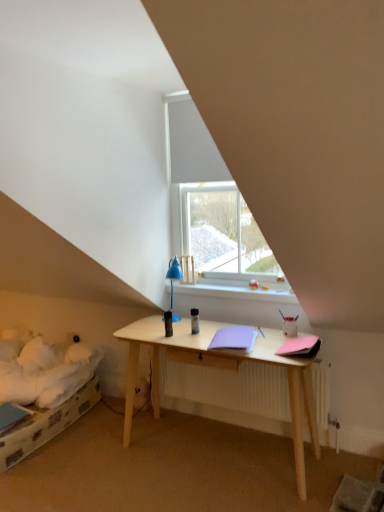
What is the approximate height of transparent glass window at center?

4.38 feet.

I want to click on transparent glass window at center, so click(211, 205).

Where is `white plastic window sill at center`? The height and width of the screenshot is (512, 384). white plastic window sill at center is located at coordinates (237, 291).

Locate an element on the screen. The width and height of the screenshot is (384, 512). transparent glass window at center is located at coordinates (211, 205).

Is point (227, 342) positioned in front of point (292, 301)?

Yes.

Considering the relative sizes of lavender matte notebook at center, positioned as the first notebook in left-to-right order, and white plastic window sill at center in the image provided, is lavender matte notebook at center, positioned as the first notebook in left-to-right order, bigger than white plastic window sill at center?

No, lavender matte notebook at center, positioned as the first notebook in left-to-right order, is not bigger than white plastic window sill at center.

From the picture: Is lavender matte notebook at center, positioned as the first notebook in left-to-right order, looking in the opposite direction of white plastic window sill at center?

No, lavender matte notebook at center, positioned as the first notebook in left-to-right order,'s orientation is not away from white plastic window sill at center.

Is lavender matte notebook at center, positioned as the first notebook in left-to-right order, at the right side of white plastic window sill at center?

Incorrect, lavender matte notebook at center, positioned as the first notebook in left-to-right order, is not on the right side of white plastic window sill at center.

You are a GUI agent. You are given a task and a screenshot of the screen. Output one action in this format:
    pyautogui.click(x=<x>, y=<y>)
    Task: Click on the 1st notebook below when counting from the white plastic window sill at center (from the image's perspective)
    This screenshot has width=384, height=512.
    Given the screenshot: What is the action you would take?
    pyautogui.click(x=234, y=338)

Between white plastic window sill at center and lavender matte notebook at center, positioned as the 2th notebook in right-to-left order, which one has more height?

With more height is white plastic window sill at center.

Choose the correct answer: Is white plastic window sill at center inside lavender matte notebook at center, positioned as the first notebook in left-to-right order, or outside it?

white plastic window sill at center is outside lavender matte notebook at center, positioned as the first notebook in left-to-right order.

From the image's perspective, which is below, white plastic window sill at center or lavender matte notebook at center, positioned as the 2th notebook in right-to-left order?

lavender matte notebook at center, positioned as the 2th notebook in right-to-left order, from the image's perspective.

How different are the orientations of transparent glass window at center and lavender matte notebook at center, positioned as the 2th notebook in right-to-left order, in degrees?

They differ by 12.9 degrees in their facing directions.

Where is `window above the lavender matte notebook at center, positioned as the first notebook in left-to-right order (from the image's perspective)`? window above the lavender matte notebook at center, positioned as the first notebook in left-to-right order (from the image's perspective) is located at coordinates (211, 205).

Considering the positions of objects transparent glass window at center and lavender matte notebook at center, positioned as the 2th notebook in right-to-left order, in the image provided, who is more to the left, transparent glass window at center or lavender matte notebook at center, positioned as the 2th notebook in right-to-left order,?

From the viewer's perspective, transparent glass window at center appears more on the left side.

Is white plastic window sill at center thinner than transparent glass window at center?

Incorrect, the width of white plastic window sill at center is not less than that of transparent glass window at center.

From the image's perspective, would you say white plastic window sill at center is positioned over transparent glass window at center?

No, from the image's perspective, white plastic window sill at center is not on top of transparent glass window at center.

Does white plastic window sill at center turn towards transparent glass window at center?

No, white plastic window sill at center is not aimed at transparent glass window at center.

This screenshot has width=384, height=512. Find the location of `window located in front of the white plastic window sill at center`. window located in front of the white plastic window sill at center is located at coordinates click(x=211, y=205).

Between pink matte notebook at right, positioned as the first notebook in right-to-left order, and white plastic window sill at center, which one has less height?

pink matte notebook at right, positioned as the first notebook in right-to-left order.

Which point is more forward, (313, 353) or (193, 294)?

Point (313, 353)

Does pink matte notebook at right, which ranks as the second notebook in left-to-right order, have a larger size compared to white plastic window sill at center?

No.

Is pink matte notebook at right, which ranks as the second notebook in left-to-right order, at the right side of white plastic window sill at center?

Indeed, pink matte notebook at right, which ranks as the second notebook in left-to-right order, is positioned on the right side of white plastic window sill at center.

Consider the image. Between lavender matte notebook at center, positioned as the first notebook in left-to-right order, and transparent glass window at center, which one has smaller size?

With smaller size is lavender matte notebook at center, positioned as the first notebook in left-to-right order.

From a real-world perspective, is lavender matte notebook at center, positioned as the 2th notebook in right-to-left order, physically located above or below transparent glass window at center?

From a real-world perspective, lavender matte notebook at center, positioned as the 2th notebook in right-to-left order, is physically below transparent glass window at center.

Could you measure the distance between lavender matte notebook at center, positioned as the 2th notebook in right-to-left order, and transparent glass window at center?

A distance of 39.02 inches exists between lavender matte notebook at center, positioned as the 2th notebook in right-to-left order, and transparent glass window at center.

Considering the positions of objects lavender matte notebook at center, positioned as the first notebook in left-to-right order, and transparent glass window at center in the image provided, who is in front, lavender matte notebook at center, positioned as the first notebook in left-to-right order, or transparent glass window at center?

lavender matte notebook at center, positioned as the first notebook in left-to-right order, is more forward.

From the image's perspective, is pink matte notebook at right, which ranks as the second notebook in left-to-right order, positioned above or below lavender matte notebook at center, positioned as the first notebook in left-to-right order?

pink matte notebook at right, which ranks as the second notebook in left-to-right order, is situated lower than lavender matte notebook at center, positioned as the first notebook in left-to-right order, in the image.

Can you confirm if pink matte notebook at right, positioned as the first notebook in right-to-left order, is thinner than lavender matte notebook at center, positioned as the 2th notebook in right-to-left order?

Indeed, pink matte notebook at right, positioned as the first notebook in right-to-left order, has a lesser width compared to lavender matte notebook at center, positioned as the 2th notebook in right-to-left order.

Can you confirm if pink matte notebook at right, positioned as the first notebook in right-to-left order, is positioned to the left of lavender matte notebook at center, positioned as the 2th notebook in right-to-left order?

No.

Is pink matte notebook at right, which ranks as the second notebook in left-to-right order, further to camera compared to lavender matte notebook at center, positioned as the 2th notebook in right-to-left order?

No, pink matte notebook at right, which ranks as the second notebook in left-to-right order, is in front of lavender matte notebook at center, positioned as the 2th notebook in right-to-left order.

The height and width of the screenshot is (512, 384). Identify the location of window sill lying above the lavender matte notebook at center, positioned as the 2th notebook in right-to-left order (from the image's perspective). pyautogui.click(x=237, y=291).

At what (x,y) coordinates should I click in order to perform the action: click on window sill above the lavender matte notebook at center, positioned as the first notebook in left-to-right order (from a real-world perspective). Please return your answer as a coordinate pair (x, y). Looking at the image, I should click on (237, 291).

Estimate the real-world distances between objects in this image. Which object is closer to white plastic window sill at center, transparent glass window at center or pink matte notebook at right, positioned as the first notebook in right-to-left order?

transparent glass window at center is closer to white plastic window sill at center.

Looking at the image, which one is located closer to transparent glass window at center, lavender matte notebook at center, positioned as the 2th notebook in right-to-left order, or pink matte notebook at right, positioned as the first notebook in right-to-left order?

lavender matte notebook at center, positioned as the 2th notebook in right-to-left order, is closer to transparent glass window at center.

Based on their spatial positions, is transparent glass window at center or white plastic window sill at center further from lavender matte notebook at center, positioned as the 2th notebook in right-to-left order?

transparent glass window at center lies further to lavender matte notebook at center, positioned as the 2th notebook in right-to-left order, than the other object.

Considering their positions, is white plastic window sill at center positioned closer to transparent glass window at center than lavender matte notebook at center, positioned as the first notebook in left-to-right order?

white plastic window sill at center lies closer to transparent glass window at center than the other object.

Considering their positions, is white plastic window sill at center positioned further to transparent glass window at center than pink matte notebook at right, which ranks as the second notebook in left-to-right order?

Among the two, pink matte notebook at right, which ranks as the second notebook in left-to-right order, is located further to transparent glass window at center.

Estimate the real-world distances between objects in this image. Which object is closer to white plastic window sill at center, pink matte notebook at right, which ranks as the second notebook in left-to-right order, or transparent glass window at center?

transparent glass window at center lies closer to white plastic window sill at center than the other object.

Looking at the image, which one is located closer to white plastic window sill at center, lavender matte notebook at center, positioned as the 2th notebook in right-to-left order, or pink matte notebook at right, positioned as the first notebook in right-to-left order?

Among the two, lavender matte notebook at center, positioned as the 2th notebook in right-to-left order, is located nearer to white plastic window sill at center.

When comparing their distances from transparent glass window at center, does pink matte notebook at right, which ranks as the second notebook in left-to-right order, or lavender matte notebook at center, positioned as the first notebook in left-to-right order, seem closer?

Based on the image, lavender matte notebook at center, positioned as the first notebook in left-to-right order, appears to be nearer to transparent glass window at center.

This screenshot has width=384, height=512. In order to click on notebook between transparent glass window at center and pink matte notebook at right, positioned as the first notebook in right-to-left order, in the vertical direction in this screenshot , I will do `click(234, 338)`.

You are a GUI agent. You are given a task and a screenshot of the screen. Output one action in this format:
    pyautogui.click(x=<x>, y=<y>)
    Task: Click on the window sill between transparent glass window at center and lavender matte notebook at center, positioned as the 2th notebook in right-to-left order, vertically
    The image size is (384, 512).
    Given the screenshot: What is the action you would take?
    pyautogui.click(x=237, y=291)

Locate an element on the screen. This screenshot has width=384, height=512. notebook between pink matte notebook at right, which ranks as the second notebook in left-to-right order, and white plastic window sill at center in the front-back direction is located at coordinates (234, 338).

Identify the location of window sill that lies between transparent glass window at center and pink matte notebook at right, positioned as the first notebook in right-to-left order, from top to bottom. This screenshot has width=384, height=512. [x=237, y=291].